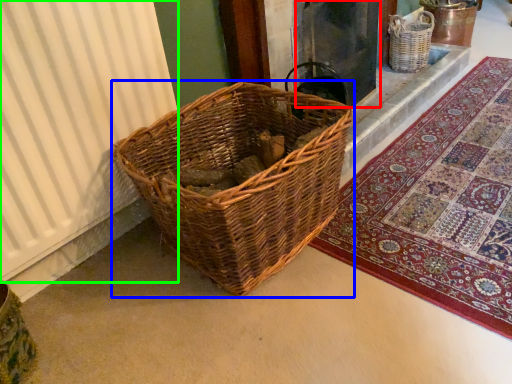
Question: Considering the real-world distances, which object is closest to screen door (highlighted by a red box)? picnic basket (highlighted by a blue box) or curtain (highlighted by a green box).

Choices:
 (A) picnic basket
 (B) curtain

Answer: (A)